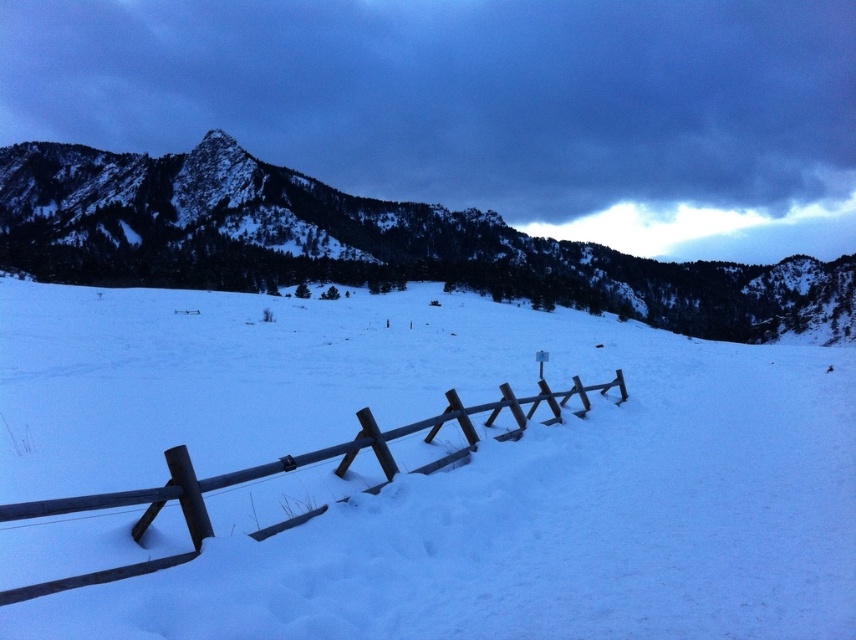
Question: Is white matte snow at center wider than snowy rocky mountain at upper left?

Choices:
 (A) yes
 (B) no

Answer: (B)

Question: Which point is closer to the camera taking this photo?

Choices:
 (A) (408, 316)
 (B) (658, 292)

Answer: (A)

Question: Which of the following is the closest to the observer?

Choices:
 (A) brown wooden fence at lower center
 (B) snowy rocky mountain at upper left

Answer: (A)

Question: Which of the following is the farthest from the observer?

Choices:
 (A) (x=205, y=340)
 (B) (x=381, y=212)

Answer: (B)

Question: Is snowy rocky mountain at upper left wider than brown wooden fence at lower center?

Choices:
 (A) no
 (B) yes

Answer: (B)

Question: Is white matte snow at center in front of brown wooden fence at lower center?

Choices:
 (A) no
 (B) yes

Answer: (B)